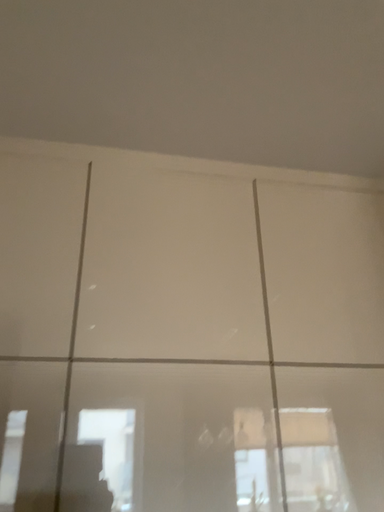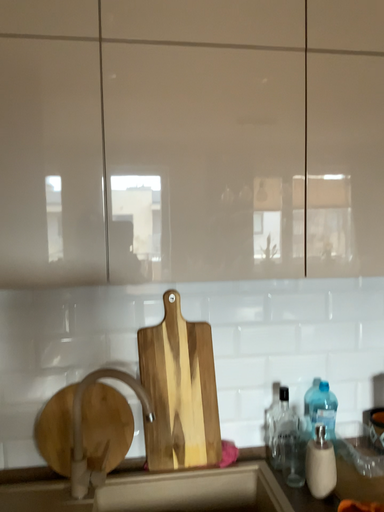
Question: Which way did the camera rotate in the video?

Choices:
 (A) rotated upward
 (B) rotated downward

Answer: (B)